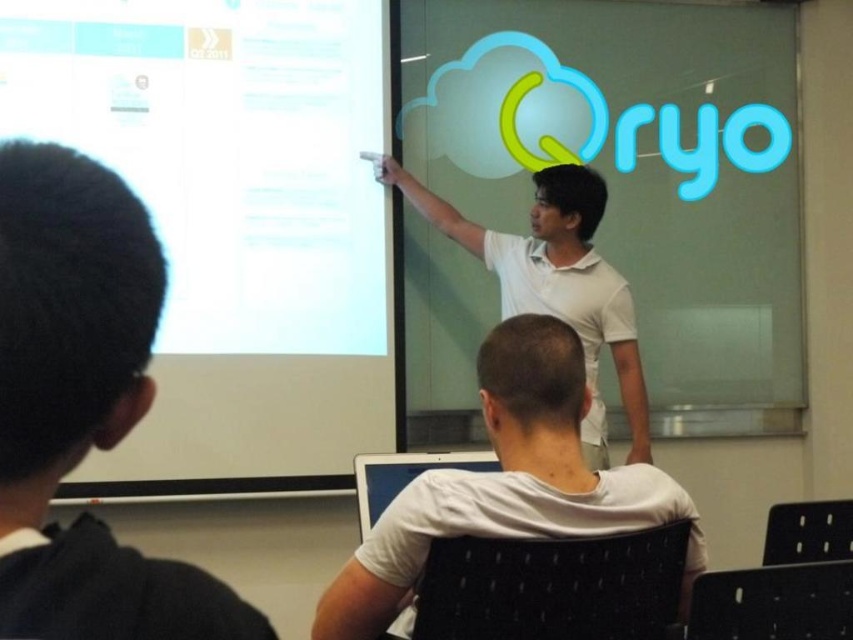
Question: Can you confirm if white matte shirt at center is positioned above white matte shirt at upper center?

Choices:
 (A) no
 (B) yes

Answer: (A)

Question: Can you confirm if transparent glass at upper center is wider than black hair at left?

Choices:
 (A) no
 (B) yes

Answer: (B)

Question: Which of these objects is positioned farthest from the white matte shirt at upper center?

Choices:
 (A) transparent glass at upper center
 (B) white matte shirt at center

Answer: (B)

Question: In this image, where is white glossy projection screen at upper left located relative to white matte shirt at upper center?

Choices:
 (A) above
 (B) below

Answer: (A)

Question: Which point is farther from the camera taking this photo?

Choices:
 (A) (595, 273)
 (B) (68, 554)

Answer: (A)

Question: Which of the following is the closest to the observer?

Choices:
 (A) transparent glass at upper center
 (B) white matte shirt at upper center

Answer: (B)